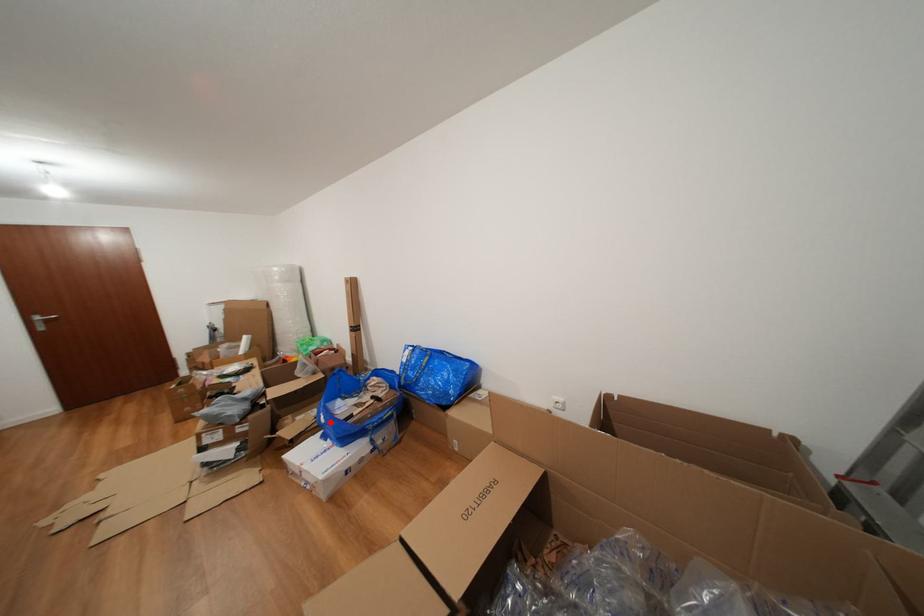
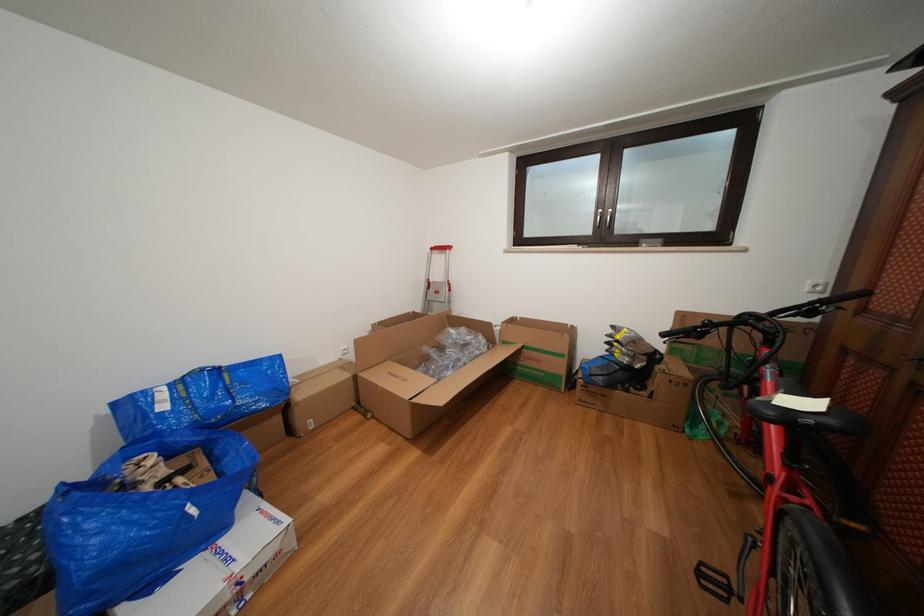
Find the pixel in the second image that matches the highlighted location in the first image.

(201, 516)